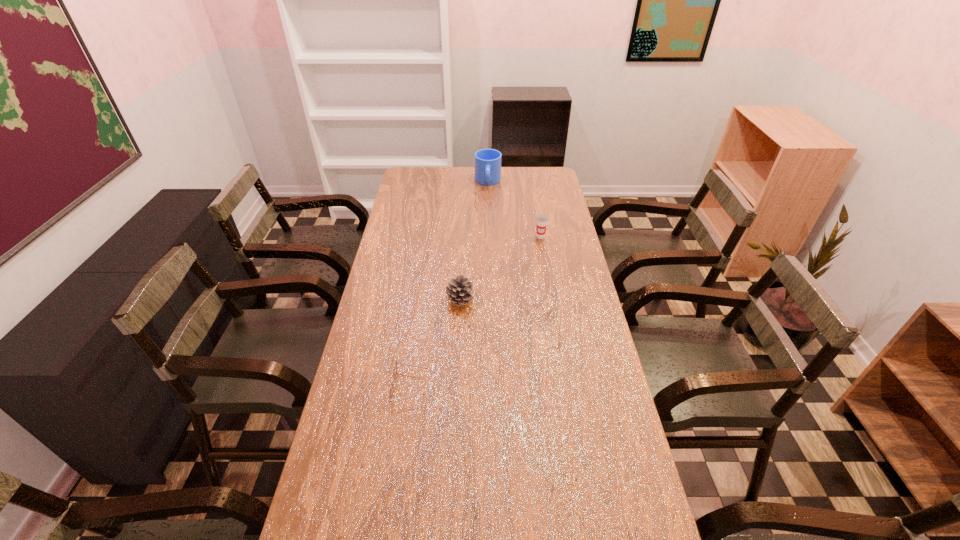
Image resolution: width=960 pixels, height=540 pixels. Identify the location of mug. (487, 161).

The height and width of the screenshot is (540, 960). In order to click on the second farthest object in this screenshot , I will do `click(542, 220)`.

I want to click on cup, so click(x=542, y=220).

Where is `the third farthest object`? The height and width of the screenshot is (540, 960). the third farthest object is located at coordinates (459, 289).

The width and height of the screenshot is (960, 540). Find the location of `the second shortest object`. the second shortest object is located at coordinates (459, 289).

I want to click on the leftmost object, so click(395, 365).

The height and width of the screenshot is (540, 960). In order to click on the nearest object in this screenshot , I will do `click(395, 365)`.

Identify the location of free region located on the side of the farthest object with the handle. This screenshot has width=960, height=540. (489, 213).

Find the location of a particular element. The width and height of the screenshot is (960, 540). free space located on the side of the third nearest object with the logo is located at coordinates (553, 310).

I want to click on free space located 0.160m on the front of the pinecone, so click(x=458, y=347).